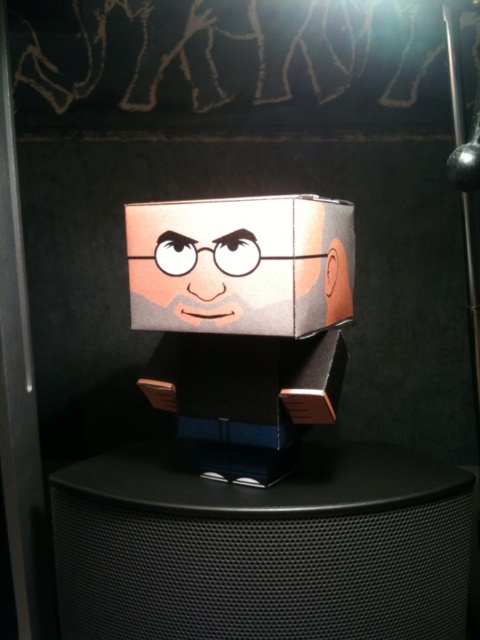
Question: Among these objects, which one is nearest to the camera?

Choices:
 (A) matte cardboard box at center
 (B) black mesh speaker at center

Answer: (A)

Question: Which object is the farthest from the matte paper face at center?

Choices:
 (A) black mesh speaker at center
 (B) matte cardboard box at center

Answer: (A)

Question: Is black mesh speaker at center smaller than matte cardboard box at center?

Choices:
 (A) no
 (B) yes

Answer: (A)

Question: Can you confirm if black mesh speaker at center is positioned to the left of matte cardboard box at center?

Choices:
 (A) no
 (B) yes

Answer: (B)

Question: Is black mesh speaker at center to the right of matte paper face at center from the viewer's perspective?

Choices:
 (A) yes
 (B) no

Answer: (A)

Question: Among these points, which one is farthest from the camera?

Choices:
 (A) (383, 572)
 (B) (283, 234)
 (C) (160, 262)

Answer: (C)